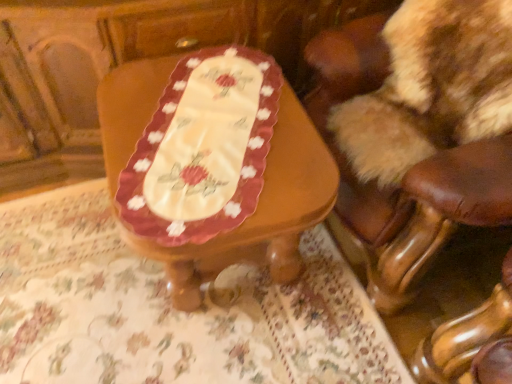
Locate an element on the screen. Image resolution: width=512 pixels, height=384 pixels. vacant space situated above wooden table at center (from a real-world perspective) is located at coordinates (206, 128).